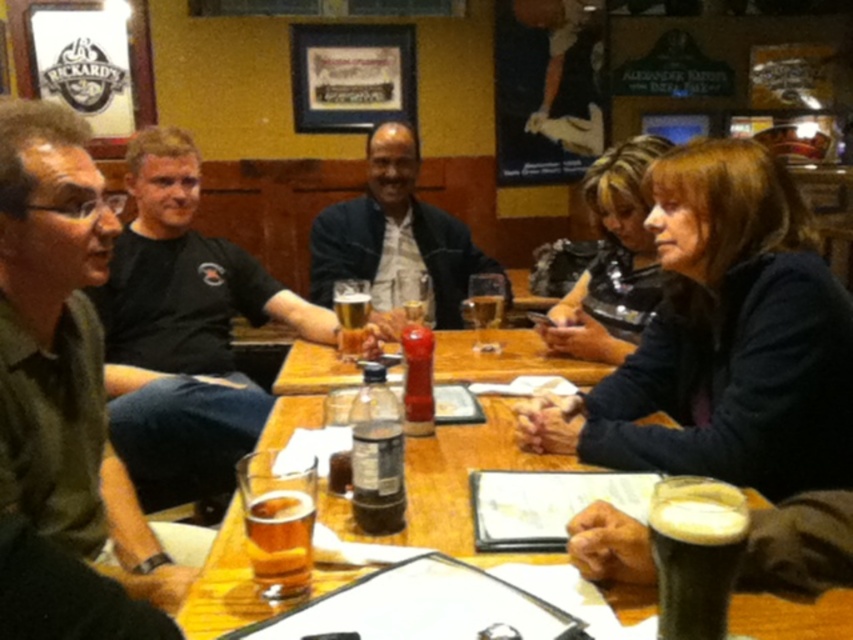
You are a server at the pub and need to place a 22 inch long platter between the dark brown hair at center and the foamy dark brown at lower right. Can you fit it there?

The dark brown hair at center and the foamy dark brown at lower right are 24.00 inches apart, so yes, the 22 inch platter can fit between them as there is enough space.

You are a server at the pub and need to deliver a drink to the person wearing the black cotton shirt at left. The drink must be placed on the wooden table at center. Can you place the drink directly in front of the shirt without moving the shirt?

The black cotton shirt at left is 17.11 inches away from the wooden table at center. Since the shirt is not on the table, the drink can be placed directly on the table in front of the shirt as there is sufficient space between them.

You are standing at the edge of the table and want to place a small vase between the two points labeled point (764, 230) and point (715, 532). Which point is closer to you so the vase can be placed there?

Point (764, 230) is further to the viewer than point (715, 532). Therefore, point (715, 532) is closer to you, so you should place the vase near that point.